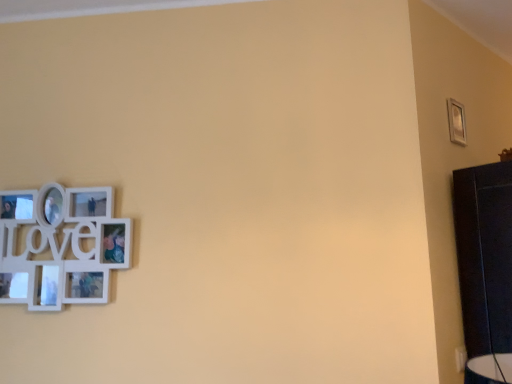
Where is `silver metallic picture frame at upper right, the second picture frame positioned from the left`? silver metallic picture frame at upper right, the second picture frame positioned from the left is located at coordinates (456, 122).

What do you see at coordinates (456, 122) in the screenshot? The width and height of the screenshot is (512, 384). I see `silver metallic picture frame at upper right, the second picture frame when ordered from bottom to top` at bounding box center [456, 122].

Describe the element at coordinates (61, 246) in the screenshot. This screenshot has width=512, height=384. I see `white matte picture frame at left, arranged as the 1th picture frame when ordered from the bottom` at that location.

This screenshot has height=384, width=512. In order to click on white matte picture frame at left, arranged as the second picture frame when viewed from the back in this screenshot , I will do `click(61, 246)`.

What is the approximate height of white matte picture frame at left, arranged as the 1th picture frame when viewed from the front?

white matte picture frame at left, arranged as the 1th picture frame when viewed from the front, is 19.15 inches tall.

Locate an element on the screen. This screenshot has width=512, height=384. silver metallic picture frame at upper right, the second picture frame positioned from the front is located at coordinates (456, 122).

Which is more to the right, silver metallic picture frame at upper right, the second picture frame positioned from the left, or white matte picture frame at left, arranged as the second picture frame when viewed from the back?

From the viewer's perspective, silver metallic picture frame at upper right, the second picture frame positioned from the left, appears more on the right side.

Which object is closer to the camera, silver metallic picture frame at upper right, which ranks as the first picture frame in right-to-left order, or white matte picture frame at left, positioned as the first picture frame in left-to-right order?

white matte picture frame at left, positioned as the first picture frame in left-to-right order, is closer to the camera.

Is point (457, 122) in front of point (70, 228)?

That is False.

From the picture: From the image's perspective, which object appears higher, silver metallic picture frame at upper right, the second picture frame positioned from the front, or white matte picture frame at left, arranged as the 1th picture frame when ordered from the bottom?

silver metallic picture frame at upper right, the second picture frame positioned from the front.

From a real-world perspective, who is located higher, silver metallic picture frame at upper right, the second picture frame positioned from the front, or white matte picture frame at left, arranged as the 1th picture frame when viewed from the front?

In real-world perspective, silver metallic picture frame at upper right, the second picture frame positioned from the front, is above.

In terms of width, does silver metallic picture frame at upper right, the second picture frame positioned from the left, look wider or thinner when compared to white matte picture frame at left, arranged as the 1th picture frame when viewed from the front?

silver metallic picture frame at upper right, the second picture frame positioned from the left, is thinner than white matte picture frame at left, arranged as the 1th picture frame when viewed from the front.

Based on the photo, considering the sizes of silver metallic picture frame at upper right, the second picture frame when ordered from bottom to top, and white matte picture frame at left, positioned as the first picture frame in left-to-right order, in the image, is silver metallic picture frame at upper right, the second picture frame when ordered from bottom to top, taller or shorter than white matte picture frame at left, positioned as the first picture frame in left-to-right order,?

Considering their sizes, silver metallic picture frame at upper right, the second picture frame when ordered from bottom to top, has less height than white matte picture frame at left, positioned as the first picture frame in left-to-right order.

Between silver metallic picture frame at upper right, the second picture frame positioned from the front, and white matte picture frame at left, arranged as the 1th picture frame when ordered from the bottom, which one has larger size?

With larger size is white matte picture frame at left, arranged as the 1th picture frame when ordered from the bottom.

Is white matte picture frame at left, arranged as the second picture frame when viewed from the back, completely or partially inside silver metallic picture frame at upper right, the 1th picture frame in the back-to-front sequence?

Definitely not — white matte picture frame at left, arranged as the second picture frame when viewed from the back, is not inside silver metallic picture frame at upper right, the 1th picture frame in the back-to-front sequence.

Consider the image. Would you say silver metallic picture frame at upper right, the 1th picture frame in the back-to-front sequence, is a long distance from white matte picture frame at left, arranged as the 1th picture frame when viewed from the front?

Absolutely, silver metallic picture frame at upper right, the 1th picture frame in the back-to-front sequence, is distant from white matte picture frame at left, arranged as the 1th picture frame when viewed from the front.

Based on the photo, is silver metallic picture frame at upper right, the 1th picture frame viewed from the top, facing towards white matte picture frame at left, positioned as the first picture frame in left-to-right order?

No.

How different are the orientations of silver metallic picture frame at upper right, the second picture frame positioned from the front, and white matte picture frame at left, marked as the second picture frame in a right-to-left arrangement, in degrees?

There is a 46.8-degree angle between the facing directions of silver metallic picture frame at upper right, the second picture frame positioned from the front, and white matte picture frame at left, marked as the second picture frame in a right-to-left arrangement.

At what (x,y) coordinates should I click in order to perform the action: click on picture frame located on the left of silver metallic picture frame at upper right, the 1th picture frame viewed from the top. Please return your answer as a coordinate pair (x, y). The width and height of the screenshot is (512, 384). Looking at the image, I should click on (61, 246).

Visually, is white matte picture frame at left, positioned as the first picture frame in left-to-right order, positioned to the left or to the right of silver metallic picture frame at upper right, the second picture frame positioned from the left?

From the image, it's evident that white matte picture frame at left, positioned as the first picture frame in left-to-right order, is to the left of silver metallic picture frame at upper right, the second picture frame positioned from the left.

Which is behind, white matte picture frame at left, marked as the second picture frame in a right-to-left arrangement, or silver metallic picture frame at upper right, which ranks as the first picture frame in right-to-left order?

silver metallic picture frame at upper right, which ranks as the first picture frame in right-to-left order.

Which is closer, (60, 217) or (454, 133)?

Positioned in front is point (60, 217).

From the image's perspective, relative to silver metallic picture frame at upper right, the 1th picture frame viewed from the top, is white matte picture frame at left, arranged as the second picture frame when viewed from the back, above or below?

From the image's perspective, white matte picture frame at left, arranged as the second picture frame when viewed from the back, appears below silver metallic picture frame at upper right, the 1th picture frame viewed from the top.

From a real-world perspective, is white matte picture frame at left, positioned as the first picture frame in left-to-right order, positioned under silver metallic picture frame at upper right, the second picture frame positioned from the front, based on gravity?

Indeed, from a real-world perspective, white matte picture frame at left, positioned as the first picture frame in left-to-right order, is positioned beneath silver metallic picture frame at upper right, the second picture frame positioned from the front.

In the scene shown: Is white matte picture frame at left, arranged as the 1th picture frame when viewed from the front, thinner than silver metallic picture frame at upper right, the second picture frame positioned from the left?

In fact, white matte picture frame at left, arranged as the 1th picture frame when viewed from the front, might be wider than silver metallic picture frame at upper right, the second picture frame positioned from the left.

Considering the sizes of objects white matte picture frame at left, positioned as the first picture frame in left-to-right order, and silver metallic picture frame at upper right, which ranks as the first picture frame in right-to-left order, in the image provided, who is taller, white matte picture frame at left, positioned as the first picture frame in left-to-right order, or silver metallic picture frame at upper right, which ranks as the first picture frame in right-to-left order,?

With more height is white matte picture frame at left, positioned as the first picture frame in left-to-right order.

Can you confirm if white matte picture frame at left, arranged as the 1th picture frame when viewed from the front, is bigger than silver metallic picture frame at upper right, the second picture frame when ordered from bottom to top?

Correct, white matte picture frame at left, arranged as the 1th picture frame when viewed from the front, is larger in size than silver metallic picture frame at upper right, the second picture frame when ordered from bottom to top.

Would you say white matte picture frame at left, arranged as the second picture frame when viewed from the back, contains silver metallic picture frame at upper right, which ranks as the first picture frame in right-to-left order?

Definitely not — silver metallic picture frame at upper right, which ranks as the first picture frame in right-to-left order, is not inside white matte picture frame at left, arranged as the second picture frame when viewed from the back.

Is the surface of white matte picture frame at left, positioned as the first picture frame in left-to-right order, in direct contact with silver metallic picture frame at upper right, the 1th picture frame in the back-to-front sequence?

No, white matte picture frame at left, positioned as the first picture frame in left-to-right order, is not beside silver metallic picture frame at upper right, the 1th picture frame in the back-to-front sequence.

Does white matte picture frame at left, positioned as the first picture frame in left-to-right order, turn towards silver metallic picture frame at upper right, the second picture frame when ordered from bottom to top?

No, white matte picture frame at left, positioned as the first picture frame in left-to-right order, is not oriented towards silver metallic picture frame at upper right, the second picture frame when ordered from bottom to top.

How different are the orientations of white matte picture frame at left, arranged as the 1th picture frame when viewed from the front, and silver metallic picture frame at upper right, the second picture frame positioned from the front, in degrees?

There is a 46.8-degree angle between the facing directions of white matte picture frame at left, arranged as the 1th picture frame when viewed from the front, and silver metallic picture frame at upper right, the second picture frame positioned from the front.

Based on the photo, how distant is white matte picture frame at left, the second picture frame from the top, from silver metallic picture frame at upper right, the second picture frame positioned from the front?

A distance of 1.50 meters exists between white matte picture frame at left, the second picture frame from the top, and silver metallic picture frame at upper right, the second picture frame positioned from the front.

You are a GUI agent. You are given a task and a screenshot of the screen. Output one action in this format:
    pyautogui.click(x=<x>, y=<y>)
    Task: Click on the picture frame lying in front of the silver metallic picture frame at upper right, the 1th picture frame viewed from the top
    This screenshot has width=512, height=384.
    Given the screenshot: What is the action you would take?
    pyautogui.click(x=61, y=246)

At what (x,y) coordinates should I click in order to perform the action: click on picture frame that is under the silver metallic picture frame at upper right, the second picture frame when ordered from bottom to top (from a real-world perspective). Please return your answer as a coordinate pair (x, y). Image resolution: width=512 pixels, height=384 pixels. Looking at the image, I should click on (61, 246).

Find the location of a particular element. Image resolution: width=512 pixels, height=384 pixels. picture frame above the white matte picture frame at left, positioned as the first picture frame in left-to-right order (from a real-world perspective) is located at coordinates (456, 122).